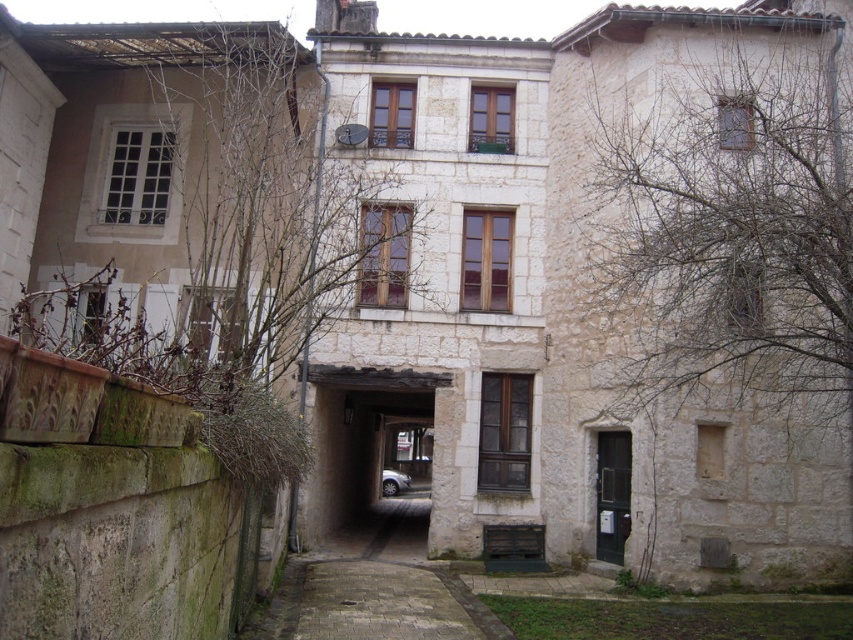
You are standing in front of the old stone building and see the bare branches at left and the silver metallic car at center. Which object is taller?

The bare branches at left is much taller than the silver metallic car at center.

You are standing in front of the old stone building and notice a bare branches at right and a silver metallic car at center. Which object is closer to you?

The bare branches at right is closer to you because it is in front of the silver metallic car at center.

You are standing in front of the old stone building and want to touch both the point at location (x=15, y=221) and the point at (x=720, y=344). Which point should you reach for first?

You should reach for the point at location (x=15, y=221) first because it is closer to you than the point at (x=720, y=344), which is further away.